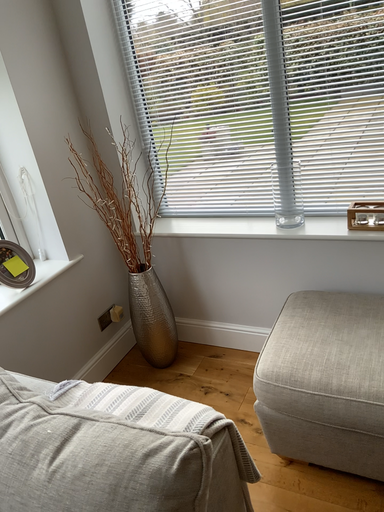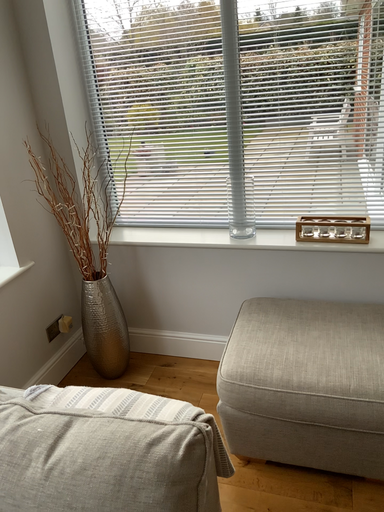
Question: How did the camera likely rotate when shooting the video?

Choices:
 (A) rotated right
 (B) rotated left

Answer: (A)